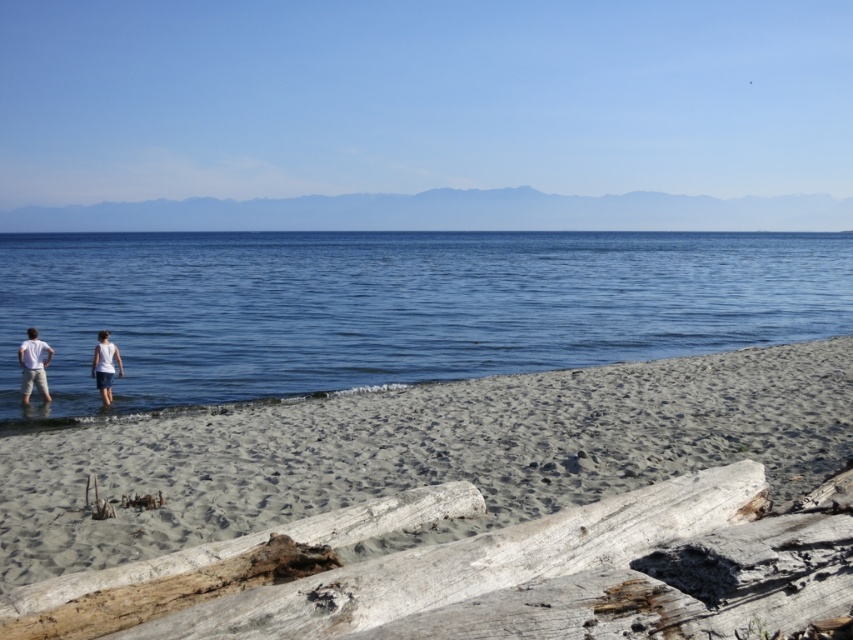
You are standing on the beach and want to reach the blue water at lower left without stepping on the weathered wood log at lower center. Which direction should you move from your current position?

You should move to the left because the blue water at lower left is positioned to the left of the weathered wood log at lower center, so moving left will take you away from the log towards the water.

You are standing at the center of the beach and want to walk towards the blue water at lower left. Which direction should you face to head directly towards it?

To head directly towards the blue water at lower left from the center of the beach, you should face the lower left direction since the blue water at lower left is located at point (393,307).

You are standing at the point labeled point (108, 400) on the beach. You want to walk to the point labeled point (108, 272). Which direction should you face to walk directly towards it?

You should face towards the direction opposite of where point (108, 400) is located because point (108, 272) is behind point (108, 400) relative to your current position.